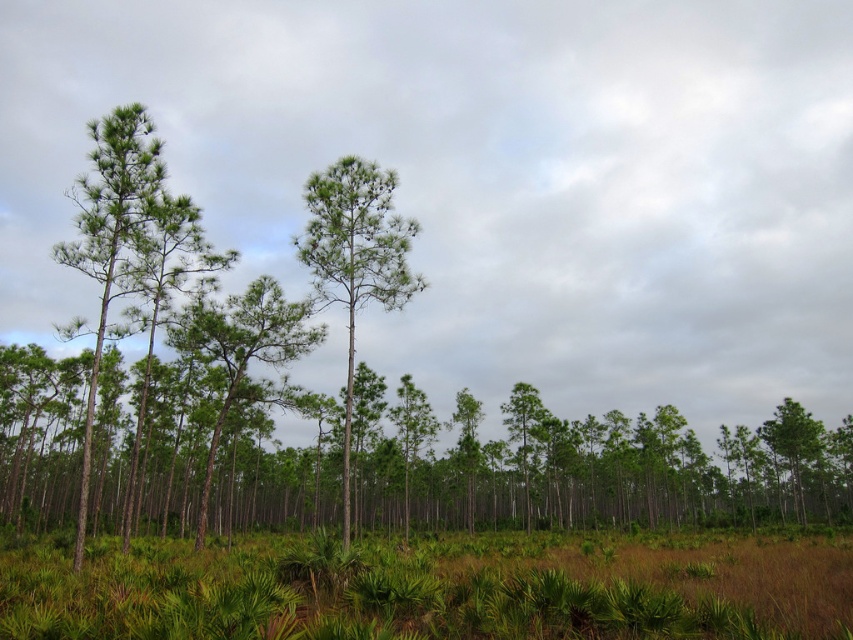
Between green leafy grass at lower center and green matte tree at center, which one has less height?

Standing shorter between the two is green leafy grass at lower center.

Between green leafy grass at lower center and green matte tree at center, which one appears on the left side from the viewer's perspective?

green matte tree at center

Image resolution: width=853 pixels, height=640 pixels. What do you see at coordinates (434, 588) in the screenshot?
I see `green leafy grass at lower center` at bounding box center [434, 588].

You are a GUI agent. You are given a task and a screenshot of the screen. Output one action in this format:
    pyautogui.click(x=<x>, y=<y>)
    Task: Click on the green leafy grass at lower center
    
    Given the screenshot: What is the action you would take?
    pyautogui.click(x=434, y=588)